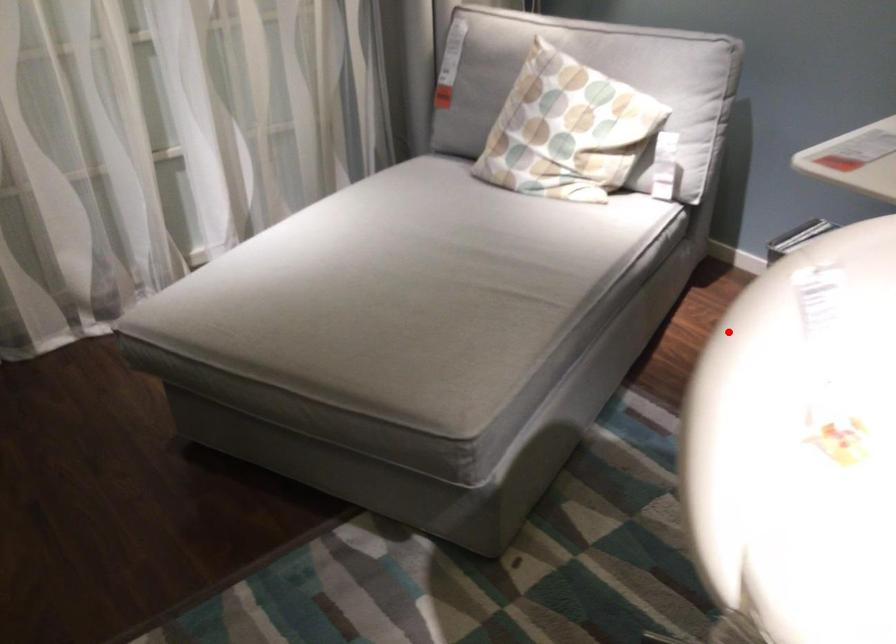
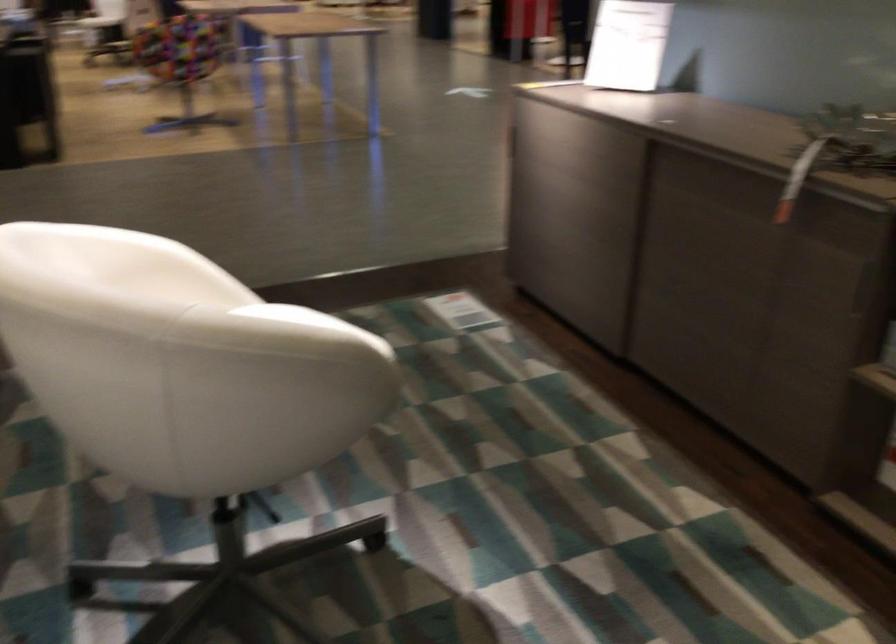
Question: I am providing you with two images of the same scene from different viewpoints. Given a red point in image1, look at the same physical point in image2. Is it:

Choices:
 (A) Closer to the viewpoint
 (B) Farther from the viewpoint

Answer: (B)